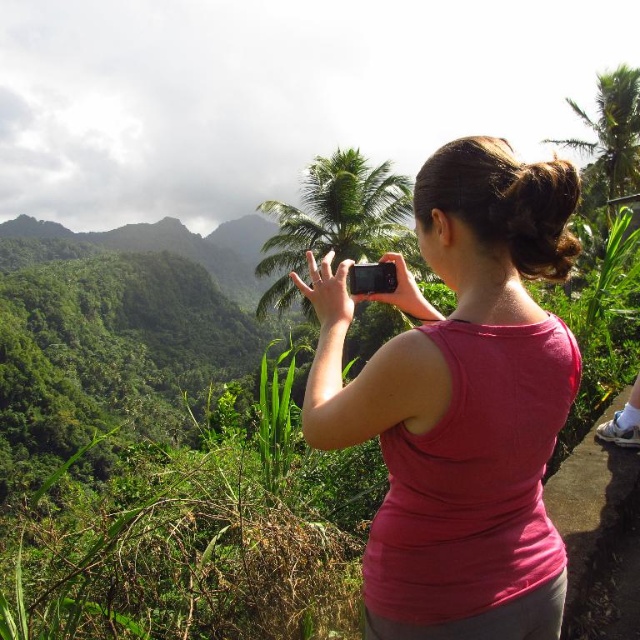
Which is above, green leafy palm tree at center or green leafy palm tree at upper right?

green leafy palm tree at upper right is higher up.

Is green leafy palm tree at center to the right of green leafy palm tree at upper right from the viewer's perspective?

In fact, green leafy palm tree at center is to the left of green leafy palm tree at upper right.

Which is behind, point (284, 212) or point (634, 120)?

Point (634, 120)

Find the location of a particular element. green leafy palm tree at center is located at coordinates (336, 221).

Who is positioned more to the right, pink fabric shirt at center or green leafy palm tree at upper right?

green leafy palm tree at upper right

Looking at this image, can you confirm if pink fabric shirt at center is wider than green leafy palm tree at upper right?

In fact, pink fabric shirt at center might be narrower than green leafy palm tree at upper right.

The height and width of the screenshot is (640, 640). Identify the location of pink fabric shirt at center. (460, 403).

Locate an element on the screen. The image size is (640, 640). pink fabric shirt at center is located at coordinates (460, 403).

Is point (493, 608) closer to camera compared to point (268, 257)?

That is True.

Does point (481, 353) lie behind point (401, 221)?

No.

The width and height of the screenshot is (640, 640). I want to click on pink fabric shirt at center, so click(x=460, y=403).